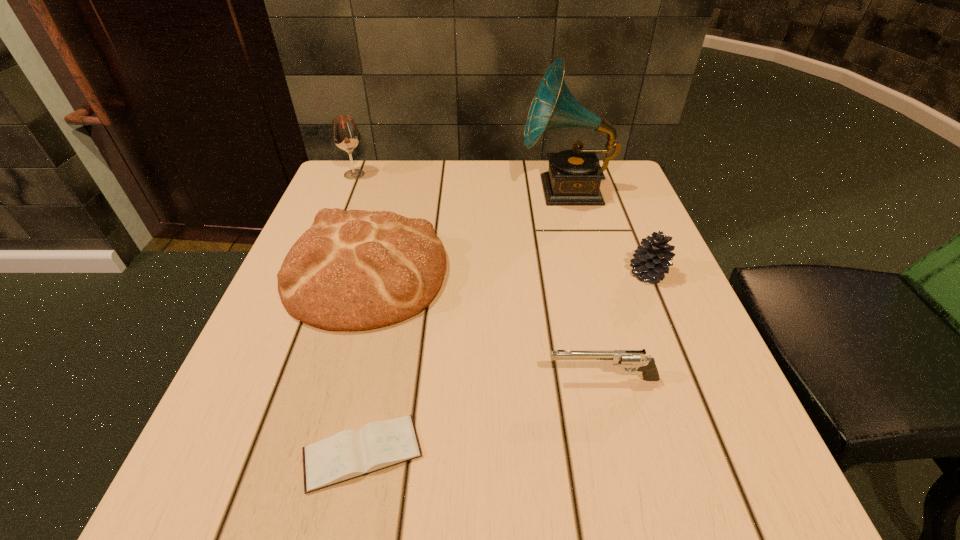
The image size is (960, 540). What are the coordinates of `blank space at the far edge` in the screenshot? It's located at (440, 210).

Identify the location of vacant area at the near edge. This screenshot has width=960, height=540. (546, 463).

Find the location of a particular element. blank area at the left edge is located at coordinates (251, 347).

I want to click on vacant space at the right edge of the desktop, so click(x=705, y=402).

Locate an element on the screen. This screenshot has height=540, width=960. free space at the far right corner is located at coordinates (620, 177).

Where is `free space between the phonograph_record and the fifth shortest object`? This screenshot has width=960, height=540. free space between the phonograph_record and the fifth shortest object is located at coordinates (460, 183).

Locate an element on the screen. The image size is (960, 540). free spot between the fourth tallest object and the fourth shortest object is located at coordinates (507, 273).

Where is `free space between the wineglass and the tallest object`? free space between the wineglass and the tallest object is located at coordinates (460, 183).

Where is `vacant space that is in between the wineglass and the pinecone`? The width and height of the screenshot is (960, 540). vacant space that is in between the wineglass and the pinecone is located at coordinates (501, 224).

Where is `free space between the pinecone and the tallest object`? The height and width of the screenshot is (540, 960). free space between the pinecone and the tallest object is located at coordinates (607, 232).